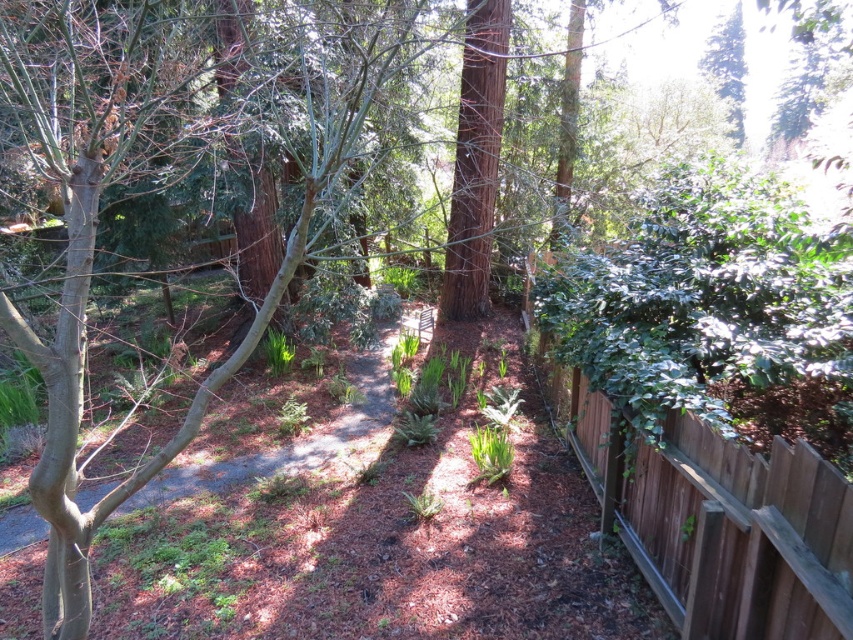
Question: Which point is farther to the camera?

Choices:
 (A) brown mulch at center
 (B) brown wood fence at right

Answer: (A)

Question: Is brown wood fence at right further to the viewer compared to brown mulch at center?

Choices:
 (A) no
 (B) yes

Answer: (A)

Question: Does brown wood fence at right appear under brown mulch at center?

Choices:
 (A) no
 (B) yes

Answer: (B)

Question: Which point is closer to the camera taking this photo?

Choices:
 (A) (120, 513)
 (B) (802, 608)

Answer: (B)

Question: Can you confirm if brown wood fence at right is positioned below brown mulch at center?

Choices:
 (A) yes
 (B) no

Answer: (A)